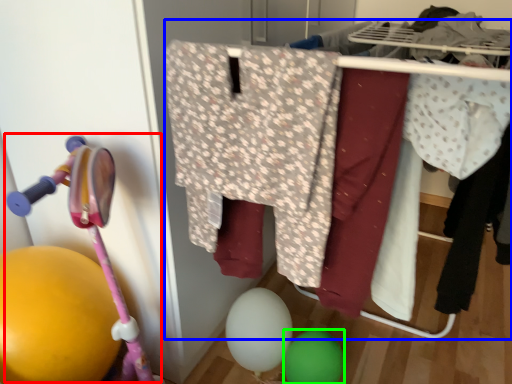
Question: Which object is positioned closest to baby carriage (highlighted by a red box)? Select from closet (highlighted by a blue box) and balloon (highlighted by a green box).

Choices:
 (A) closet
 (B) balloon

Answer: (A)